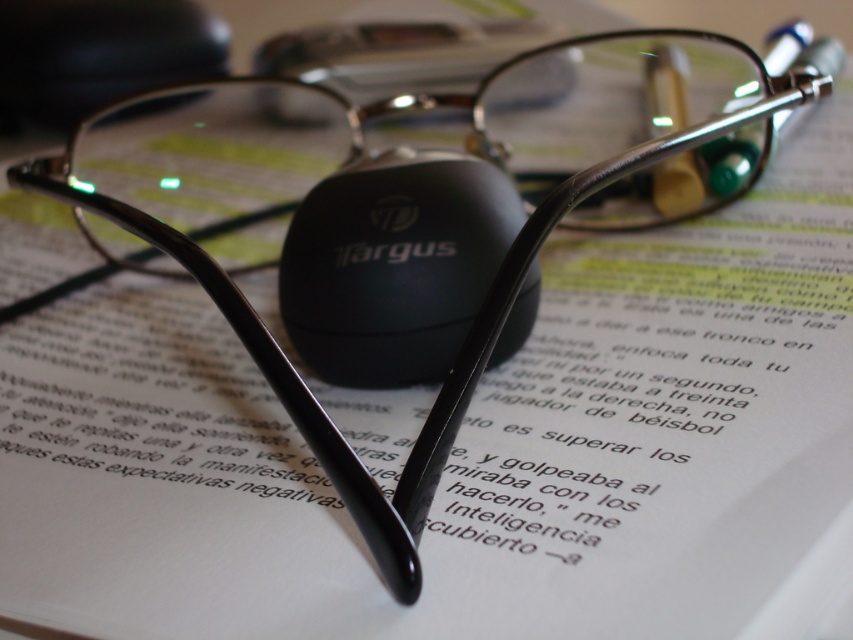
Question: Does matte black mouse at center appear on the right side of black matte mouse at upper center?

Choices:
 (A) no
 (B) yes

Answer: (B)

Question: Is matte black mouse at center smaller than black matte mouse at upper center?

Choices:
 (A) yes
 (B) no

Answer: (A)

Question: Is matte black mouse at center below black matte mouse at upper center?

Choices:
 (A) no
 (B) yes

Answer: (B)

Question: Among these points, which one is nearest to the camera?

Choices:
 (A) (109, 20)
 (B) (416, 296)

Answer: (B)

Question: Which point appears farthest from the camera in this image?

Choices:
 (A) (9, 0)
 (B) (529, 285)

Answer: (A)